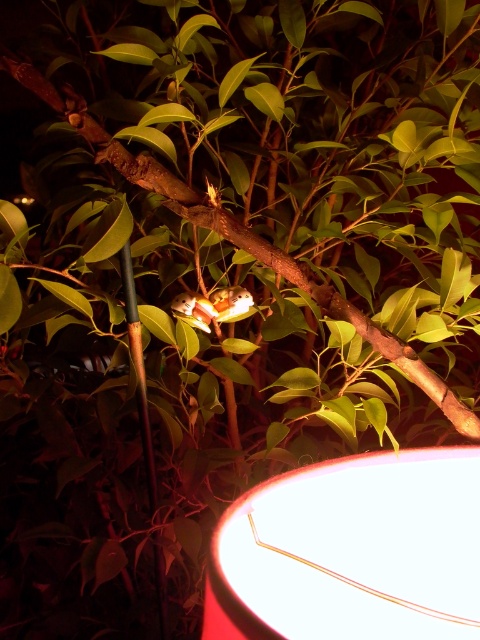
Question: Which point is farther to the camera?

Choices:
 (A) white glossy lampshade at lower right
 (B) green bamboo pole at left

Answer: (B)

Question: Does white glossy lampshade at lower right have a greater width compared to green bamboo pole at left?

Choices:
 (A) no
 (B) yes

Answer: (B)

Question: Is white glossy lampshade at lower right wider than green bamboo pole at left?

Choices:
 (A) no
 (B) yes

Answer: (B)

Question: Where is white glossy lampshade at lower right located in relation to green bamboo pole at left in the image?

Choices:
 (A) left
 (B) right

Answer: (B)

Question: Which point is closer to the camera?

Choices:
 (A) (265, 541)
 (B) (135, 348)

Answer: (A)